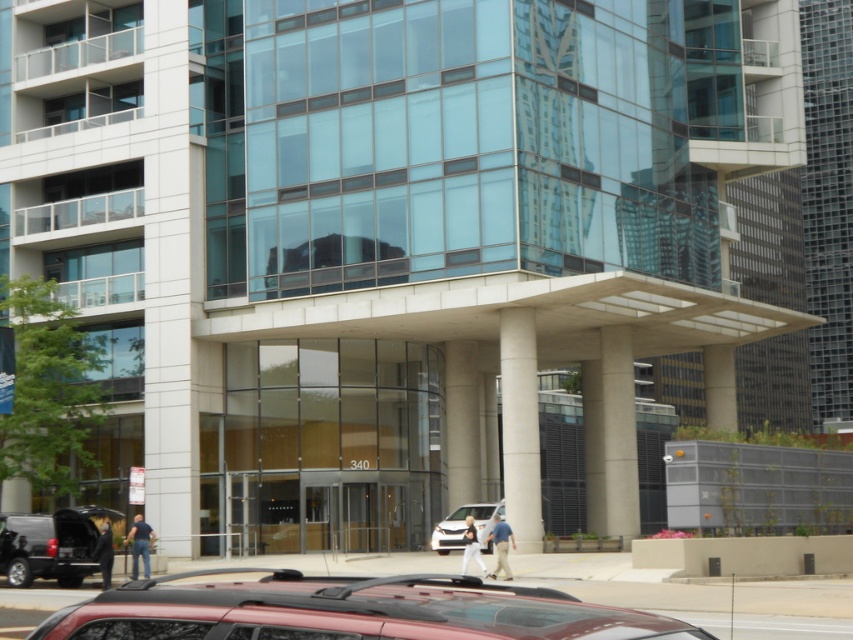
Question: Which point is closer to the camera?

Choices:
 (A) (74, 557)
 (B) (514, 353)
 (C) (466, 404)

Answer: (A)

Question: Which point appears farthest from the camera in this image?

Choices:
 (A) (503, 433)
 (B) (467, 426)
 (C) (447, 516)
 (D) (82, 563)

Answer: (B)

Question: Can you confirm if white marble pillar at center is positioned to the left of white concrete pillar at center?

Choices:
 (A) yes
 (B) no

Answer: (B)

Question: Is black matte suv at lower left positioned before white matte van at center?

Choices:
 (A) yes
 (B) no

Answer: (A)

Question: Which of these objects is positioned farthest from the shiny red suv at lower center?

Choices:
 (A) white matte van at center
 (B) white marble pillar at center
 (C) white concrete pillar at center

Answer: (C)

Question: Can you confirm if shiny red suv at lower center is positioned above black matte suv at lower left?

Choices:
 (A) no
 (B) yes

Answer: (B)